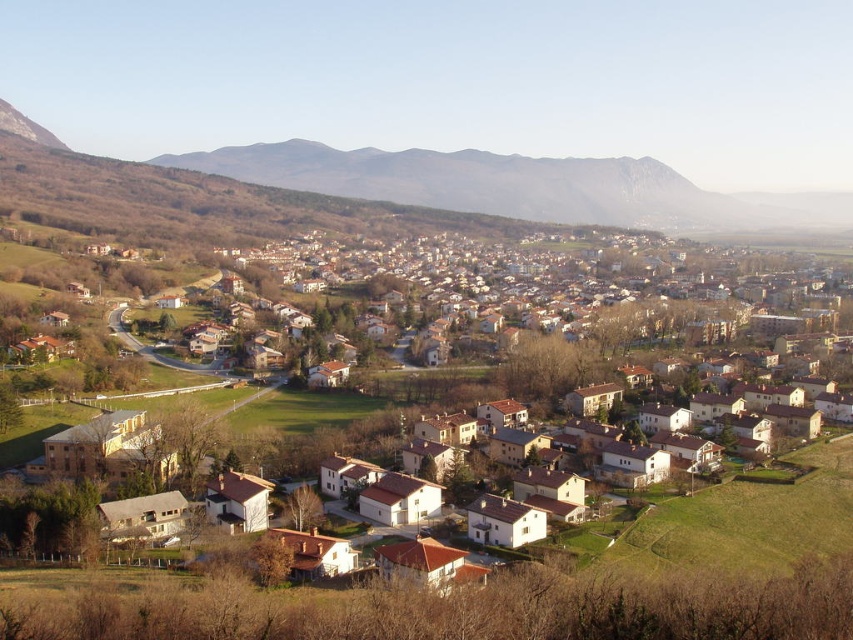
Question: Among these points, which one is farthest from the camera?

Choices:
 (A) (500, 212)
 (B) (227, 452)

Answer: (A)

Question: Which point appears farthest from the camera in this image?

Choices:
 (A) (770, 240)
 (B) (509, 456)

Answer: (A)

Question: Which point is closer to the camera?

Choices:
 (A) (474, 420)
 (B) (837, 216)

Answer: (A)

Question: Is white matte houses at center smaller than brown rocky mountain at upper center?

Choices:
 (A) no
 (B) yes

Answer: (A)

Question: Does white matte houses at center have a smaller size compared to brown rocky mountain at upper center?

Choices:
 (A) yes
 (B) no

Answer: (B)

Question: Is the position of white matte houses at center less distant than that of brown rocky mountain at upper center?

Choices:
 (A) yes
 (B) no

Answer: (A)